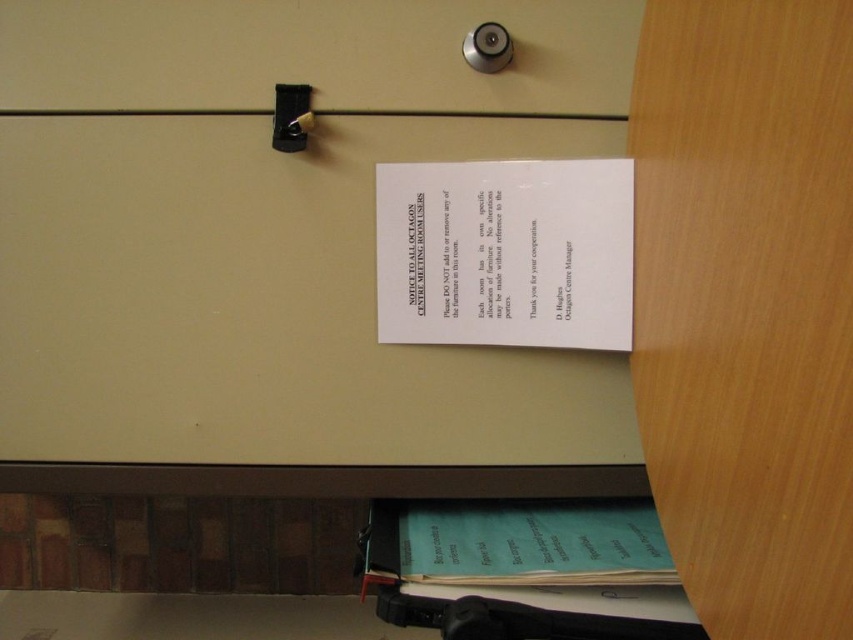
You are standing in the room and want to move from point A to point B. Point A is at coordinates point (630, 48) and point B is at coordinates point (463, 180). According to the notice, can you move any furniture to clear a path between these two points?

The notice states that you must not add to or remove any furniture in the room. Therefore, you cannot move any furniture to clear a path between point (630, 48) and point (463, 180).

You are organizing a meeting in the room and need to place a folder on the white paper at center. However, you notice the matte plastic drawer at upper center is in the way. Can you move the drawer to the right to make space?

The matte plastic drawer at upper center is to the left of the white paper at center. Since the drawer is already positioned to the left, moving it further to the right would place it closer to the paper, potentially reducing the available space. However, according to the notice on the wall, altering furniture without authorization is prohibited. Therefore, you should not move the drawer.

You are organizing a meeting in the room and need to place a laptop on an available surface. Which object between the matte plastic drawer at upper center and the white paper at center can you use for placing the laptop?

The white paper at center is larger than the matte plastic drawer at upper center, so it can accommodate the laptop better.